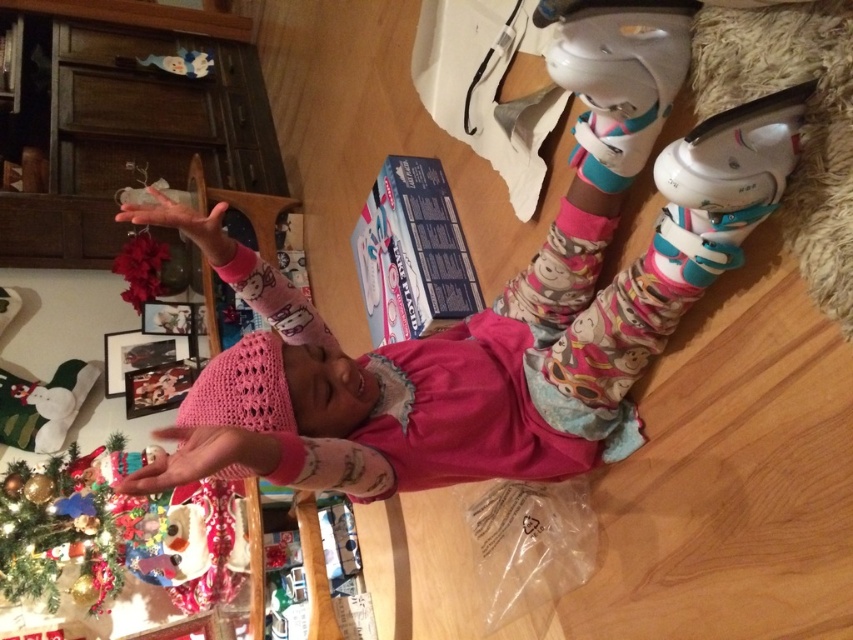
Question: Does pink knitted hat at upper center lie behind green matte christmas tree at lower left?

Choices:
 (A) no
 (B) yes

Answer: (A)

Question: Which object appears closest to the camera in this image?

Choices:
 (A) pink knitted hat at upper center
 (B) green matte christmas tree at lower left

Answer: (A)

Question: Does pink knitted hat at upper center appear over pink knitted sock at center?

Choices:
 (A) no
 (B) yes

Answer: (B)

Question: Does pink knitted hat at upper center have a lesser width compared to green matte christmas tree at lower left?

Choices:
 (A) no
 (B) yes

Answer: (A)

Question: Among these points, which one is nearest to the camera?

Choices:
 (A) (230, 260)
 (B) (578, 33)

Answer: (B)

Question: Which of the following is the closest to the observer?

Choices:
 (A) pink knitted sock at center
 (B) green matte christmas tree at lower left
 (C) pink knitted hat at upper center

Answer: (C)